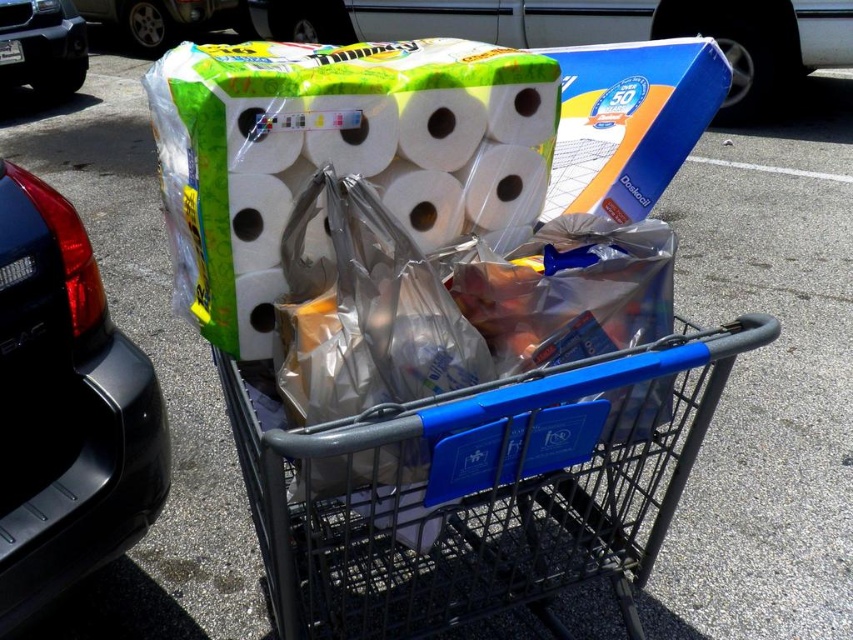
You are organizing items in a shopping cart and need to know which item is taller between the white matte toilet paper at center and the matte green paper towel at upper center. Based on the scene, which one is taller?

The matte green paper towel at upper center is taller than the white matte toilet paper at center.